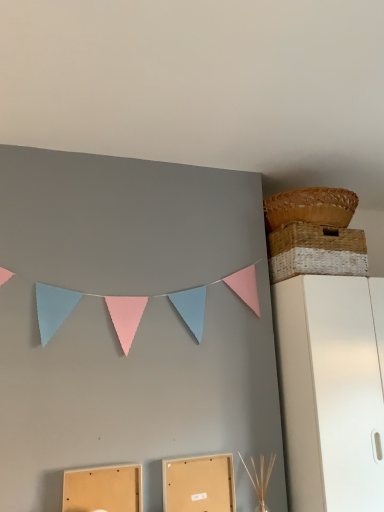
Question: Based on their sizes in the image, would you say matte cardboard box at lower center, the 2th cardboard box viewed from the right, is bigger or smaller than woven natural basket at upper right, the 2th basket when ordered from top to bottom?

Choices:
 (A) small
 (B) big

Answer: (A)

Question: From a real-world perspective, is matte cardboard box at lower center, the 2th cardboard box viewed from the right, above or below woven natural basket at upper right, which is counted as the 1th basket, starting from the bottom?

Choices:
 (A) below
 (B) above

Answer: (A)

Question: Which object is positioned farthest from the woven natural basket at upper right, the 2th basket when ordered from top to bottom?

Choices:
 (A) woven brown basket at upper right, which appears as the 2th basket when ordered from the bottom
 (B) matte cardboard box at lower center, positioned as the first cardboard box in right-to-left order
 (C) white matte cabinet at right
 (D) matte cardboard box at lower center, the 2th cardboard box viewed from the right

Answer: (D)

Question: Which is nearer to the woven natural basket at upper right, which is counted as the 1th basket, starting from the bottom?

Choices:
 (A) matte cardboard box at lower center, positioned as the first cardboard box in right-to-left order
 (B) matte cardboard box at lower center, the 2th cardboard box viewed from the right
 (C) white matte cabinet at right
 (D) woven brown basket at upper right, which appears as the first basket when viewed from the top

Answer: (D)